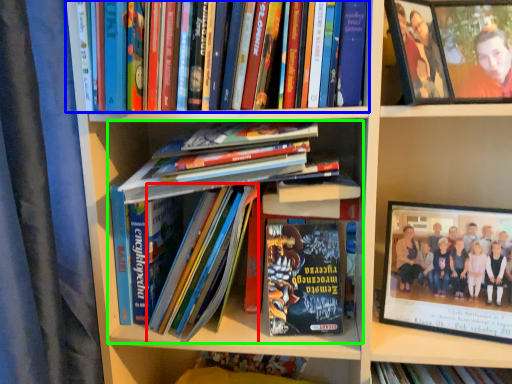
Question: Estimate the real-world distances between objects in this image. Which object is farther from book (highlighted by a red box), book (highlighted by a blue box) or book (highlighted by a green box)?

Choices:
 (A) book
 (B) book

Answer: (A)